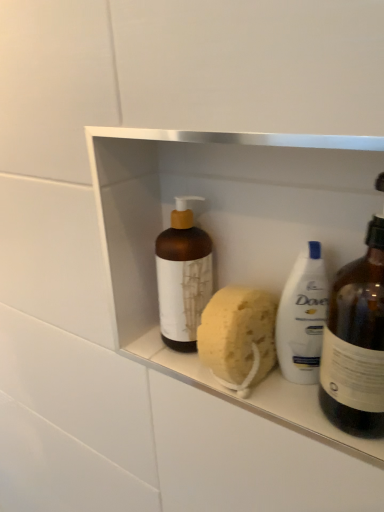
Question: Considering the positions of yellow sponge at center and brown matte bottle at center, which is the second bottle from right to left, in the image, is yellow sponge at center bigger or smaller than brown matte bottle at center, which is the second bottle from right to left,?

Choices:
 (A) small
 (B) big

Answer: (A)

Question: From the image's perspective, is yellow sponge at center located above or below brown matte bottle at center, the 1th bottle from the left?

Choices:
 (A) above
 (B) below

Answer: (B)

Question: Estimate the real-world distances between objects in this image. Which object is farther from the yellow sponge at center?

Choices:
 (A) matte brown bottle at right, marked as the first bottle in a right-to-left arrangement
 (B) brown matte bottle at center, which is the second bottle from right to left

Answer: (A)

Question: Which object is the farthest from the yellow sponge at center?

Choices:
 (A) brown matte bottle at center, the 1th bottle from the left
 (B) matte brown bottle at right, which ranks as the second bottle in left-to-right order

Answer: (B)